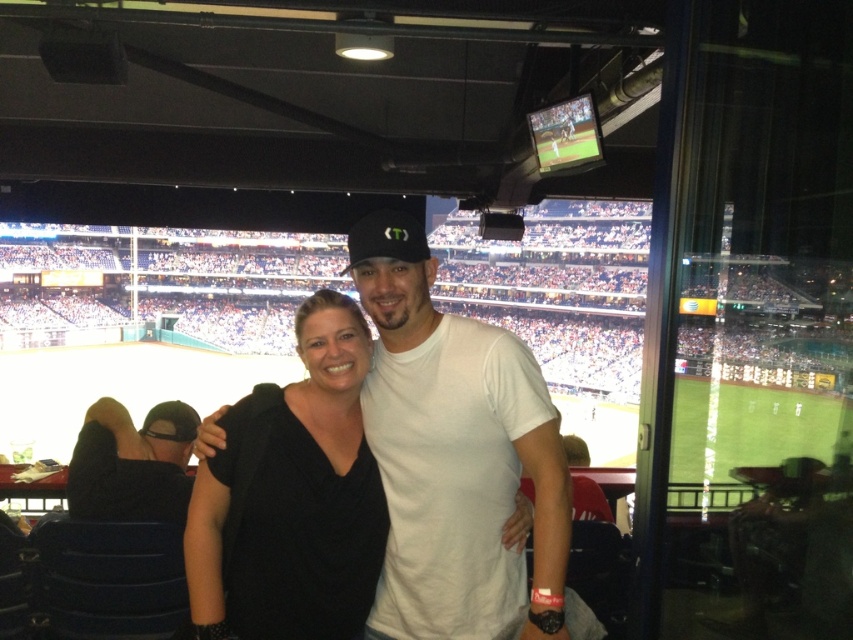
Which is more to the left, white cotton t-shirt at center or black matte shirt at center?

Positioned to the left is black matte shirt at center.

Can you confirm if white cotton t-shirt at center is bigger than black matte shirt at center?

Indeed, white cotton t-shirt at center has a larger size compared to black matte shirt at center.

Which is behind, point (479, 428) or point (320, 410)?

Point (320, 410)

You are a GUI agent. You are given a task and a screenshot of the screen. Output one action in this format:
    pyautogui.click(x=<x>, y=<y>)
    Task: Click on the white cotton t-shirt at center
    The height and width of the screenshot is (640, 853).
    Given the screenshot: What is the action you would take?
    pyautogui.click(x=460, y=470)

Can you confirm if black matte shirt at center is positioned below black matte baseball cap at center?

Yes, black matte shirt at center is below black matte baseball cap at center.

Does black matte shirt at center have a lesser width compared to black matte baseball cap at center?

No.

Describe the element at coordinates (292, 497) in the screenshot. The height and width of the screenshot is (640, 853). I see `black matte shirt at center` at that location.

Locate an element on the screen. black matte shirt at center is located at coordinates (292, 497).

Is white cotton t-shirt at center smaller than black matte baseball cap at center?

No, white cotton t-shirt at center is not smaller than black matte baseball cap at center.

Is the position of white cotton t-shirt at center more distant than that of black matte baseball cap at center?

No.

Is point (421, 502) closer to viewer compared to point (345, 269)?

Yes, it is.

Identify the location of white cotton t-shirt at center. Image resolution: width=853 pixels, height=640 pixels. (460, 470).